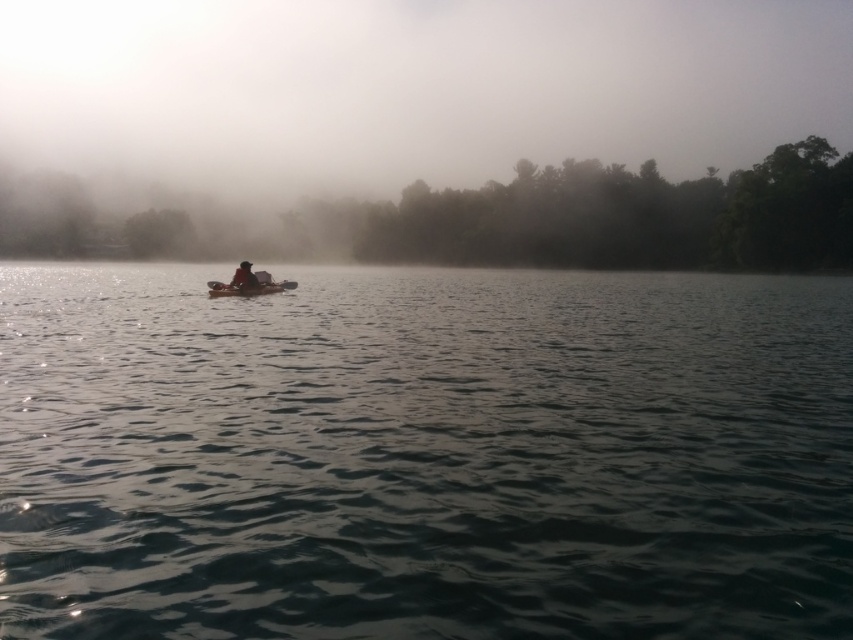
Is matte black kayak at center shorter than black plastic paddle at center?

Incorrect, matte black kayak at center's height does not fall short of black plastic paddle at center's.

Does matte black kayak at center appear over black plastic paddle at center?

Yes, matte black kayak at center is above black plastic paddle at center.

Is point (238, 280) positioned behind point (215, 282)?

That is False.

Where is `matte black kayak at center`? The image size is (853, 640). matte black kayak at center is located at coordinates (244, 276).

Does clear water at center appear on the right side of matte black kayak at center?

Indeed, clear water at center is positioned on the right side of matte black kayak at center.

How much distance is there between clear water at center and matte black kayak at center?

A distance of 6.93 meters exists between clear water at center and matte black kayak at center.

Does point (392, 580) lie in front of point (241, 278)?

Yes, it is in front of point (241, 278).

Identify the location of clear water at center. This screenshot has width=853, height=640. (424, 454).

Is clear water at center to the left of black plastic paddle at center from the viewer's perspective?

In fact, clear water at center is to the right of black plastic paddle at center.

Can you confirm if clear water at center is positioned above black plastic paddle at center?

No, clear water at center is not above black plastic paddle at center.

Which is behind, point (404, 352) or point (221, 285)?

The point (221, 285) is behind.

Locate an element on the screen. Image resolution: width=853 pixels, height=640 pixels. clear water at center is located at coordinates (424, 454).